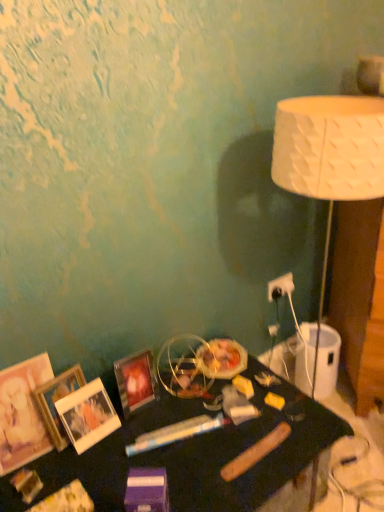
Question: From a real-world perspective, does black glossy table at lower center stand above matte glass picture frame at lower left, which is the first picture frame in right-to-left order?

Choices:
 (A) no
 (B) yes

Answer: (A)

Question: From the image's perspective, is black glossy table at lower center on top of matte glass picture frame at lower left, which is the 4th picture frame in left-to-right order?

Choices:
 (A) yes
 (B) no

Answer: (B)

Question: Does black glossy table at lower center come in front of matte glass picture frame at lower left, which is the first picture frame in right-to-left order?

Choices:
 (A) yes
 (B) no

Answer: (A)

Question: Is the position of black glossy table at lower center more distant than that of matte glass picture frame at lower left, which is the 4th picture frame in left-to-right order?

Choices:
 (A) yes
 (B) no

Answer: (B)

Question: Is black glossy table at lower center next to matte glass picture frame at lower left, which is the first picture frame in right-to-left order?

Choices:
 (A) no
 (B) yes

Answer: (A)

Question: Is black glossy table at lower center oriented towards matte glass picture frame at lower left, which is the 4th picture frame in left-to-right order?

Choices:
 (A) no
 (B) yes

Answer: (A)

Question: From the image's perspective, is matte wooden picture frame at left, positioned as the 1th picture frame in left-to-right order, on white textured lampshade at right?

Choices:
 (A) no
 (B) yes

Answer: (A)

Question: Is matte wooden picture frame at left, which ranks as the fourth picture frame in right-to-left order, directly adjacent to white textured lampshade at right?

Choices:
 (A) no
 (B) yes

Answer: (A)

Question: Does matte wooden picture frame at left, positioned as the 1th picture frame in left-to-right order, lie behind white textured lampshade at right?

Choices:
 (A) yes
 (B) no

Answer: (B)

Question: Could white textured lampshade at right be considered to be inside matte wooden picture frame at left, which ranks as the fourth picture frame in right-to-left order?

Choices:
 (A) no
 (B) yes

Answer: (A)

Question: Is there a large distance between matte wooden picture frame at left, which ranks as the fourth picture frame in right-to-left order, and white textured lampshade at right?

Choices:
 (A) yes
 (B) no

Answer: (A)

Question: Can we say matte wooden picture frame at left, which ranks as the fourth picture frame in right-to-left order, lies outside white textured lampshade at right?

Choices:
 (A) no
 (B) yes

Answer: (B)

Question: Does white plastic electric outlet at upper right come in front of wooden photo frame at lower left, placed as the second picture frame when sorted from left to right?

Choices:
 (A) no
 (B) yes

Answer: (A)